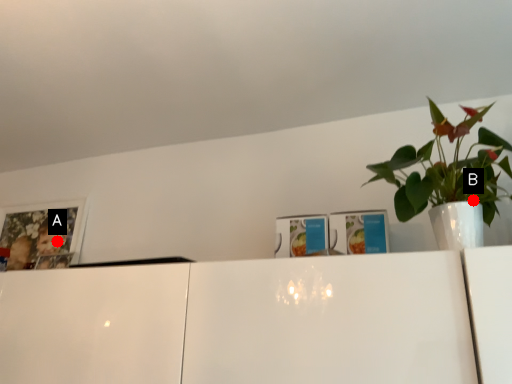
Question: Two points are circled on the image, labeled by A and B beside each circle. Which point is farther to the camera?

Choices:
 (A) A is further
 (B) B is further

Answer: (A)